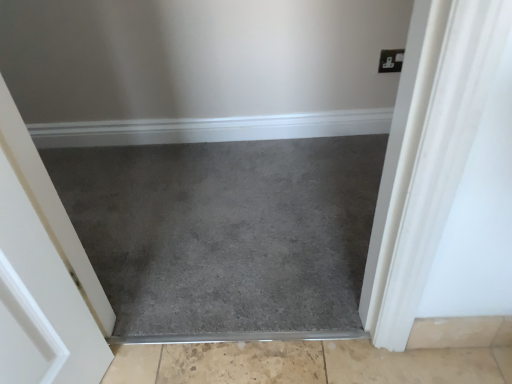
Question: From the image's perspective, is beige textured concrete at bottom, the 1th concrete in the bottom-to-top sequence, on top of slate carpet at center?

Choices:
 (A) yes
 (B) no

Answer: (B)

Question: Can slate carpet at center be found inside beige textured concrete at bottom, positioned as the 2th concrete in top-to-bottom order?

Choices:
 (A) yes
 (B) no

Answer: (B)

Question: Considering the relative sizes of beige textured concrete at bottom, positioned as the 2th concrete in top-to-bottom order, and slate carpet at center in the image provided, is beige textured concrete at bottom, positioned as the 2th concrete in top-to-bottom order, bigger than slate carpet at center?

Choices:
 (A) yes
 (B) no

Answer: (B)

Question: Considering the relative positions of beige textured concrete at bottom, the 1th concrete in the bottom-to-top sequence, and slate carpet at center in the image provided, is beige textured concrete at bottom, the 1th concrete in the bottom-to-top sequence, to the left of slate carpet at center from the viewer's perspective?

Choices:
 (A) yes
 (B) no

Answer: (B)

Question: Is beige textured concrete at bottom, the 1th concrete in the bottom-to-top sequence, not close to slate carpet at center?

Choices:
 (A) no
 (B) yes

Answer: (A)

Question: In terms of height, does beige textured concrete at bottom, positioned as the 2th concrete in top-to-bottom order, look taller or shorter compared to beige tile at lower right, which ranks as the second concrete in bottom-to-top order?

Choices:
 (A) tall
 (B) short

Answer: (B)

Question: Does point (210, 360) appear closer or farther from the camera than point (432, 329)?

Choices:
 (A) closer
 (B) farther

Answer: (B)

Question: Considering the relative positions of beige textured concrete at bottom, the 1th concrete in the bottom-to-top sequence, and beige tile at lower right, which ranks as the second concrete in bottom-to-top order, in the image provided, is beige textured concrete at bottom, the 1th concrete in the bottom-to-top sequence, to the left or to the right of beige tile at lower right, which ranks as the second concrete in bottom-to-top order,?

Choices:
 (A) left
 (B) right

Answer: (A)

Question: Is beige textured concrete at bottom, the 1th concrete in the bottom-to-top sequence, in front of or behind beige tile at lower right, the 1th concrete in the top-to-bottom sequence, in the image?

Choices:
 (A) behind
 (B) front

Answer: (A)

Question: Looking at the image, does slate carpet at center seem bigger or smaller compared to beige textured concrete at bottom, positioned as the 2th concrete in top-to-bottom order?

Choices:
 (A) big
 (B) small

Answer: (A)

Question: Based on their positions, is slate carpet at center located to the left or right of beige textured concrete at bottom, the 1th concrete in the bottom-to-top sequence?

Choices:
 (A) right
 (B) left

Answer: (B)

Question: From a real-world perspective, relative to beige textured concrete at bottom, positioned as the 2th concrete in top-to-bottom order, is slate carpet at center vertically above or below?

Choices:
 (A) above
 (B) below

Answer: (A)

Question: Considering the positions of slate carpet at center and beige textured concrete at bottom, the 1th concrete in the bottom-to-top sequence, in the image, is slate carpet at center taller or shorter than beige textured concrete at bottom, the 1th concrete in the bottom-to-top sequence,?

Choices:
 (A) short
 (B) tall

Answer: (B)

Question: Considering the positions of point (252, 354) and point (151, 296), is point (252, 354) closer or farther from the camera than point (151, 296)?

Choices:
 (A) closer
 (B) farther

Answer: (A)

Question: Considering the positions of beige textured concrete at bottom, the 1th concrete in the bottom-to-top sequence, and slate carpet at center in the image, is beige textured concrete at bottom, the 1th concrete in the bottom-to-top sequence, taller or shorter than slate carpet at center?

Choices:
 (A) short
 (B) tall

Answer: (A)